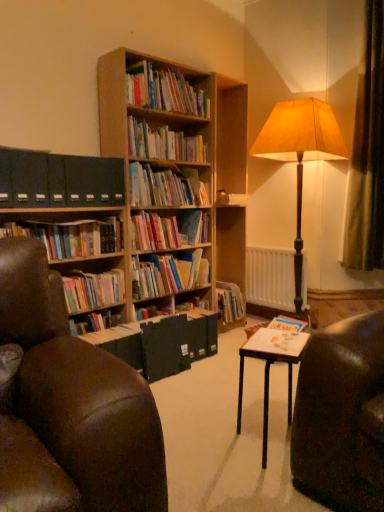
Where is `vacant space situated on the left part of wooden table at center`? The image size is (384, 512). vacant space situated on the left part of wooden table at center is located at coordinates (196, 442).